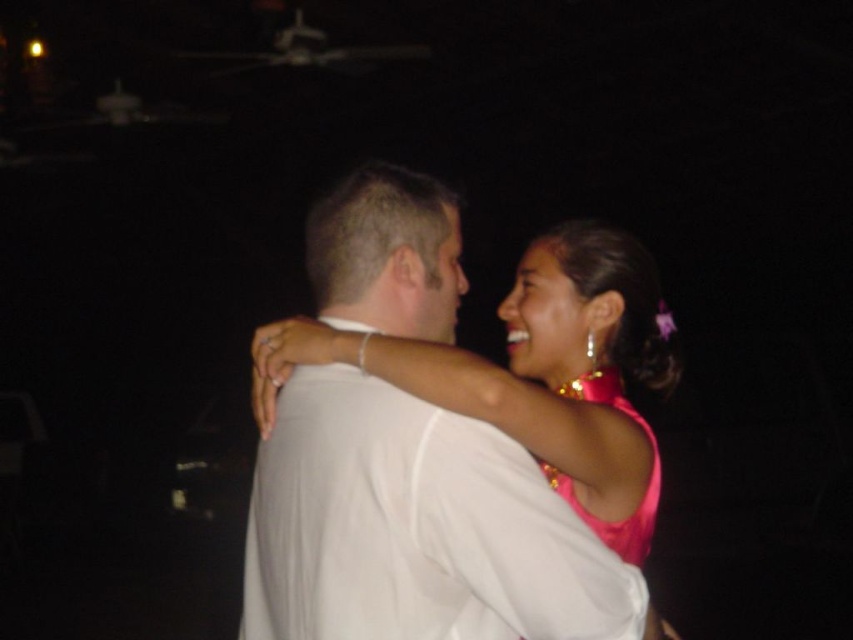
Question: Is pink satin dress at center wider than pink satin dress at upper right?

Choices:
 (A) yes
 (B) no

Answer: (A)

Question: Among these objects, which one is farthest from the camera?

Choices:
 (A) pink satin dress at upper right
 (B) pink satin dress at center

Answer: (A)

Question: Does pink satin dress at center appear on the left side of pink satin dress at upper right?

Choices:
 (A) no
 (B) yes

Answer: (B)

Question: Which point appears farthest from the camera in this image?

Choices:
 (A) (561, 387)
 (B) (393, 432)

Answer: (A)

Question: Can you confirm if pink satin dress at center is smaller than pink satin dress at upper right?

Choices:
 (A) no
 (B) yes

Answer: (A)